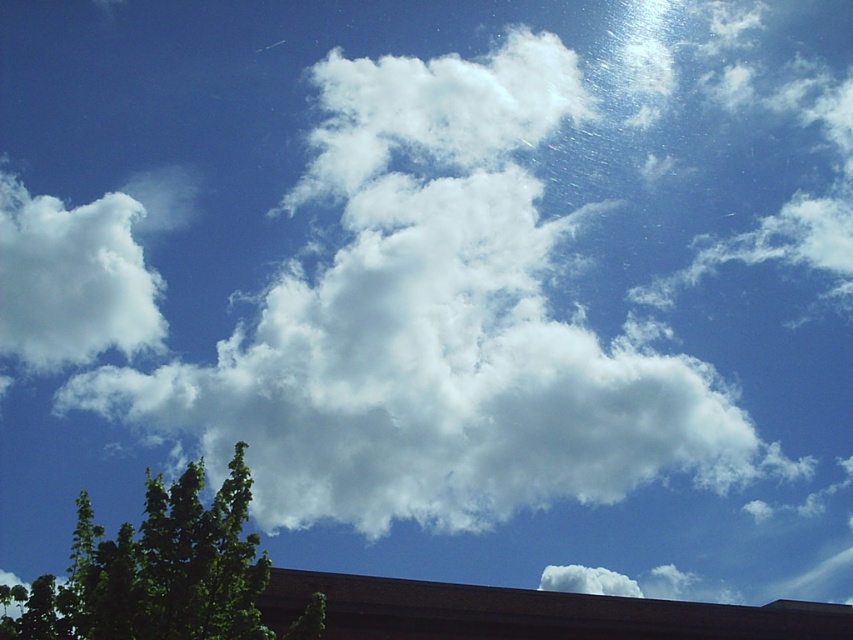
You are a bird flying at an altitude of 50 meters. You see the green leafy tree at lower left and the white fluffy cloud at upper left. Which object is closer to you?

The green leafy tree at lower left is closer to you because it is located at 50 meters below the cloud, which is 95.46 meters away from the tree.

You are an architect designing a new park and want to ensure that the green leafy tree at lower left will not block the view of the white fluffy cloud at upper left from the main observation deck. Based on their positions, is this possible?

The green leafy tree at lower left is below the white fluffy cloud at upper left, so the tree will not block the view of the cloud from the observation deck as they are positioned vertically apart.

You are standing in a field and want to take a photo of the green leafy tree at lower left and the white fluffy cloud at upper left. Which object will appear larger in the photo?

The green leafy tree at lower left will appear larger in the photo because it is closer to the viewer than the white fluffy cloud at upper left.